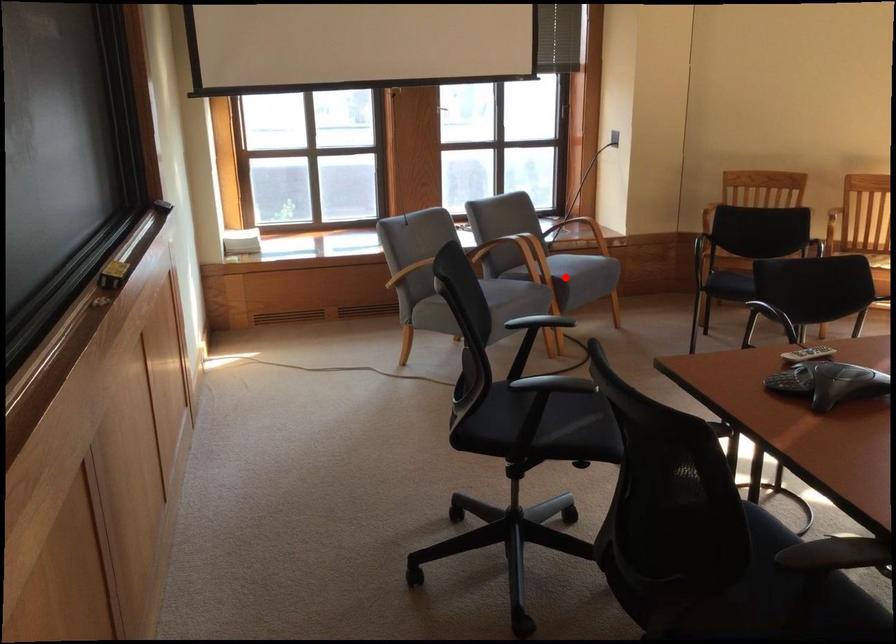
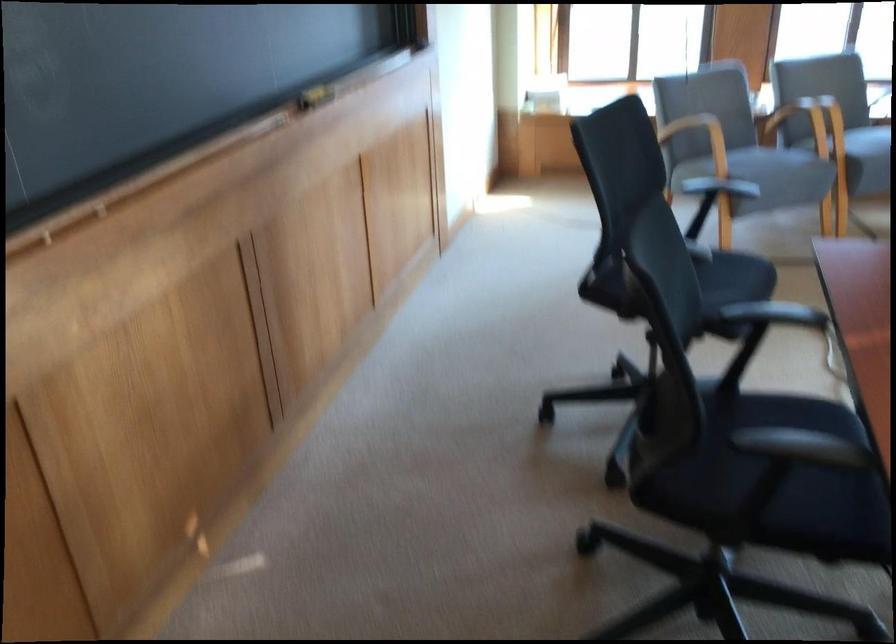
Locate, in the second image, the point that corresponds to the highlighted location in the first image.

(859, 152)